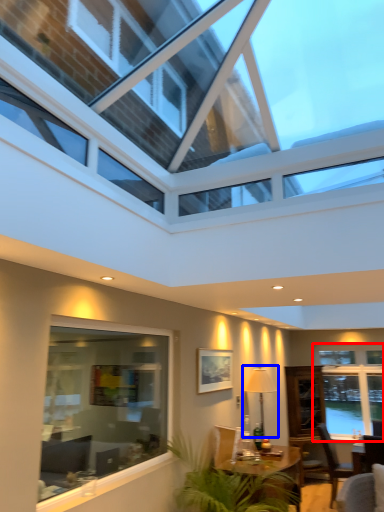
Question: Which object appears farthest to the camera in this image, window (highlighted by a red box) or lamp (highlighted by a blue box)?

Choices:
 (A) window
 (B) lamp

Answer: (A)